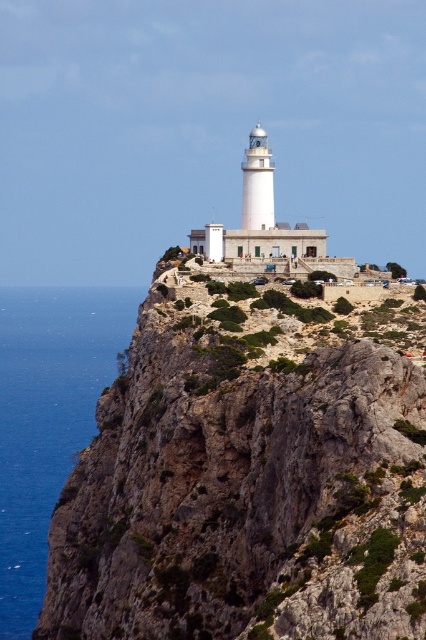
Who is positioned more to the left, brown rough rock at upper center or blue liquid water at left?

blue liquid water at left is more to the left.

Does brown rough rock at upper center have a lesser width compared to blue liquid water at left?

Yes.

The height and width of the screenshot is (640, 426). I want to click on brown rough rock at upper center, so click(249, 474).